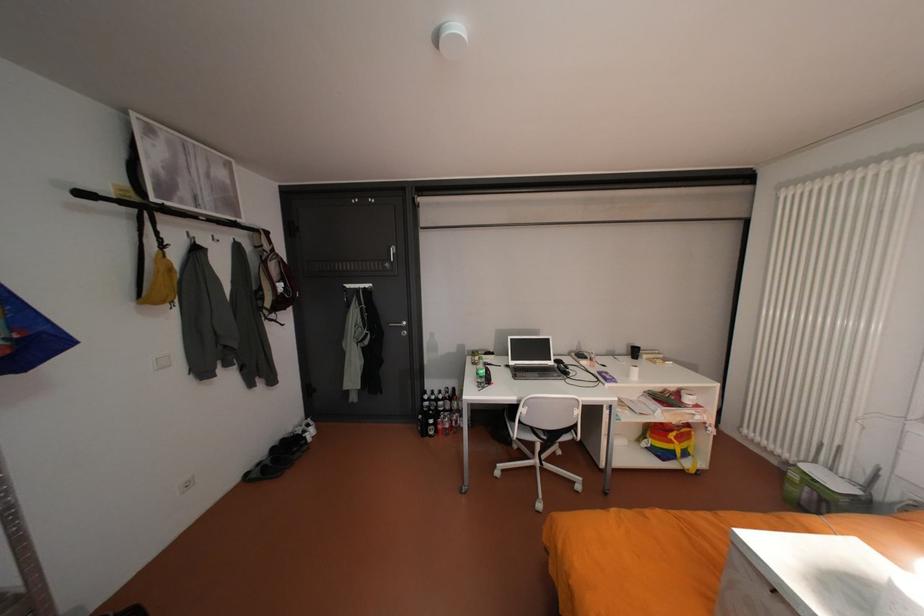
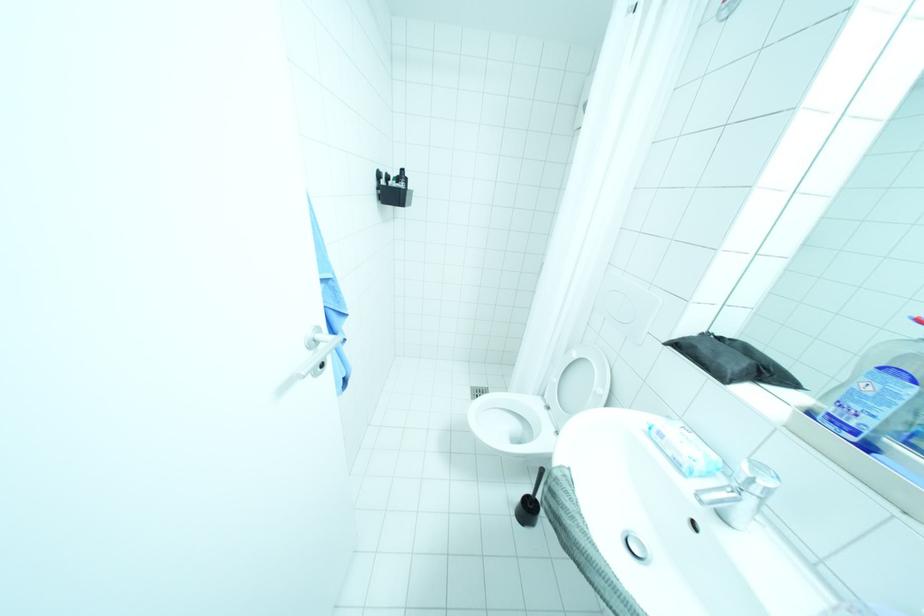
The first image is from the beginning of the video and the second image is from the end. How did the camera likely rotate when shooting the video?

The camera rotated toward right-down.